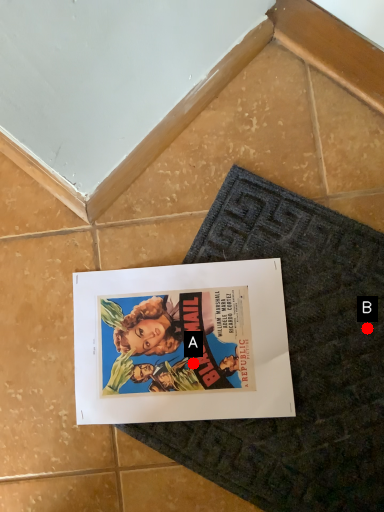
Question: Two points are circled on the image, labeled by A and B beside each circle. Among these points, which one is farthest from the camera?

Choices:
 (A) A is further
 (B) B is further

Answer: (A)